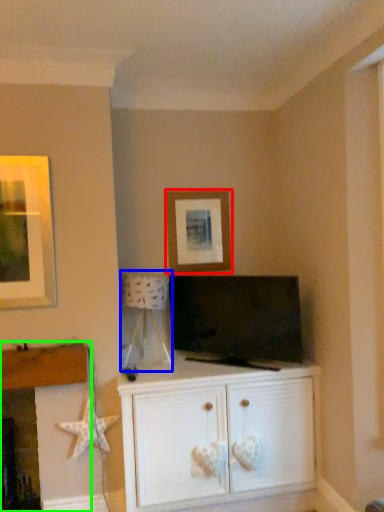
Question: Which is nearer to the picture frame (highlighted by a red box)? lamp (highlighted by a blue box) or fireplace (highlighted by a green box).

Choices:
 (A) lamp
 (B) fireplace

Answer: (A)